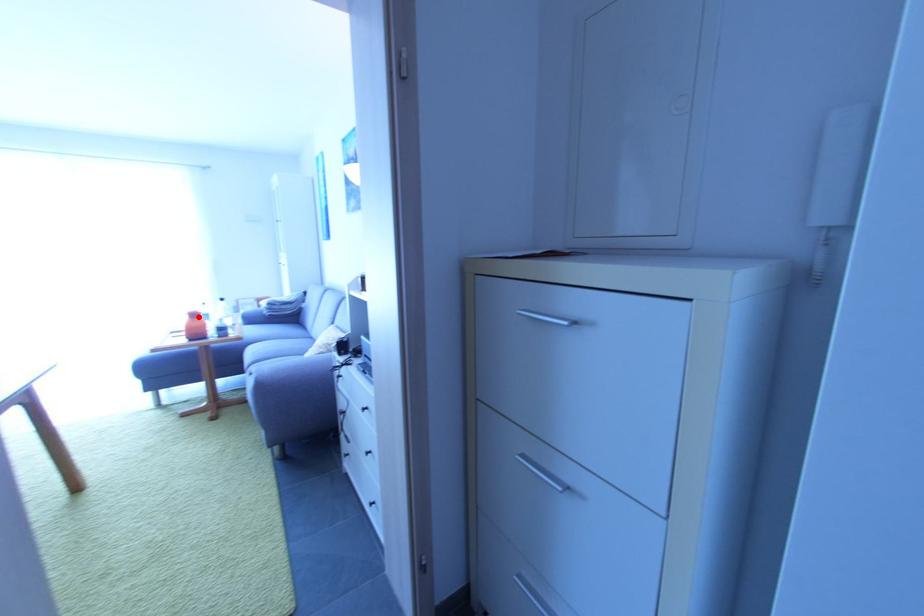
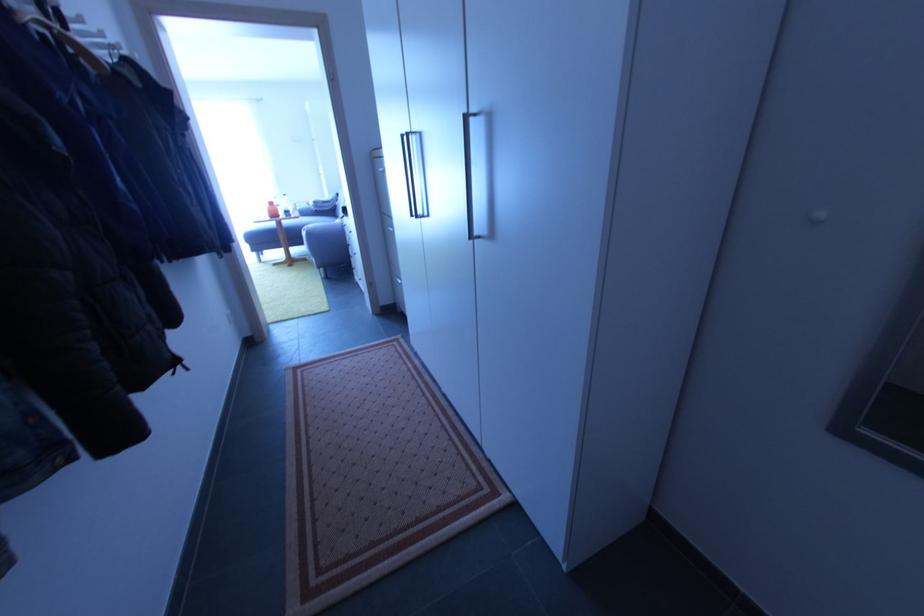
Question: I am providing you with two images of the same scene from different viewpoints. Given a red point in image1, look at the same physical point in image2. Is it:

Choices:
 (A) Closer to the viewpoint
 (B) Farther from the viewpoint

Answer: (A)